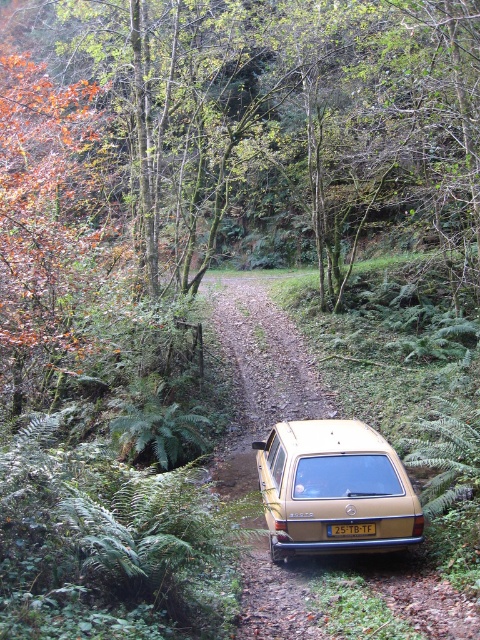
Question: Can you confirm if brown leafy tree at upper left is positioned to the left of gold matte station wagon at center?

Choices:
 (A) yes
 (B) no

Answer: (A)

Question: Observing the image, what is the correct spatial positioning of brown leafy tree at upper left in reference to gold matte station wagon at center?

Choices:
 (A) above
 (B) below

Answer: (A)

Question: Among these objects, which one is nearest to the camera?

Choices:
 (A) brown leafy tree at upper left
 (B) yellow plastic license plate at center

Answer: (B)

Question: Considering the real-world distances, which object is farthest from the yellow plastic license plate at center?

Choices:
 (A) brown leafy tree at upper left
 (B) gold matte station wagon at center

Answer: (A)

Question: Is gold matte station wagon at center to the left of yellow plastic license plate at center from the viewer's perspective?

Choices:
 (A) no
 (B) yes

Answer: (B)

Question: Among these points, which one is nearest to the camera?

Choices:
 (A) tap(271, 474)
 (B) tap(184, 67)

Answer: (A)